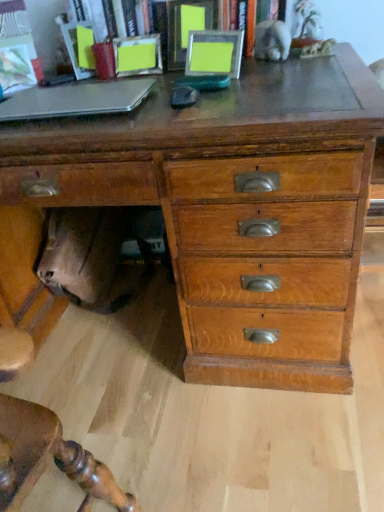
What is the approximate height of metallic silver photo frames at upper center?

metallic silver photo frames at upper center is 9.91 inches tall.

I want to click on wooden chest of drawers at center, so click(236, 208).

From a real-world perspective, is metallic silver photo frames at upper center physically above wooden chest of drawers at center?

Yes, from a real-world perspective, metallic silver photo frames at upper center is on top of wooden chest of drawers at center.

Can you tell me how much metallic silver photo frames at upper center and wooden chest of drawers at center differ in facing direction?

They differ by 0.673 degrees in their facing directions.

From the image's perspective, is metallic silver photo frames at upper center beneath wooden chest of drawers at center?

No.

Does metallic silver photo frames at upper center come behind wooden chest of drawers at center?

Yes, metallic silver photo frames at upper center is behind wooden chest of drawers at center.

From the image's perspective, is silver metallic laptop at left beneath metallic silver photo frames at upper center?

Yes, from the image's perspective, silver metallic laptop at left is beneath metallic silver photo frames at upper center.

Where is `bookcase above the silver metallic laptop at left (from a real-world perspective)`? bookcase above the silver metallic laptop at left (from a real-world perspective) is located at coordinates (186, 26).

Is silver metallic laptop at left oriented away from metallic silver photo frames at upper center?

Yes, silver metallic laptop at left is facing away from metallic silver photo frames at upper center.

Who is shorter, silver metallic laptop at left or metallic silver photo frames at upper center?

With less height is silver metallic laptop at left.

In order to click on the chest of drawers located below the silver metallic laptop at left (from the image's perspective) in this screenshot , I will do `click(236, 208)`.

Based on the photo, does wooden chest of drawers at center turn towards silver metallic laptop at left?

No, wooden chest of drawers at center is not aimed at silver metallic laptop at left.

Which is in front, point (283, 362) or point (92, 82)?

The point (283, 362) is more forward.

Considering the sizes of objects wooden chest of drawers at center and silver metallic laptop at left in the image provided, who is shorter, wooden chest of drawers at center or silver metallic laptop at left?

silver metallic laptop at left.

Could you tell me if wooden chest of drawers at center is turned towards metallic silver photo frames at upper center?

No, wooden chest of drawers at center is not turned towards metallic silver photo frames at upper center.

Is the position of wooden chest of drawers at center more distant than that of metallic silver photo frames at upper center?

No, wooden chest of drawers at center is in front of metallic silver photo frames at upper center.

From the image's perspective, is wooden chest of drawers at center positioned above or below metallic silver photo frames at upper center?

Based on their image positions, wooden chest of drawers at center is located beneath metallic silver photo frames at upper center.

Is silver metallic laptop at left facing away from wooden chest of drawers at center?

No, silver metallic laptop at left is not facing away from wooden chest of drawers at center.

Do you think silver metallic laptop at left is within wooden chest of drawers at center, or outside of it?

silver metallic laptop at left is located beyond the bounds of wooden chest of drawers at center.

Is silver metallic laptop at left taller or shorter than wooden chest of drawers at center?

Clearly, silver metallic laptop at left is shorter compared to wooden chest of drawers at center.

The image size is (384, 512). What are the coordinates of `laptop that appears behind the wooden chest of drawers at center` in the screenshot? It's located at (76, 99).

Does metallic silver photo frames at upper center lie in front of silver metallic laptop at left?

No, metallic silver photo frames at upper center is further to the viewer.

Is metallic silver photo frames at upper center outside of silver metallic laptop at left?

Yes, metallic silver photo frames at upper center is outside of silver metallic laptop at left.

Measure the distance from metallic silver photo frames at upper center to silver metallic laptop at left.

A distance of 16.53 inches exists between metallic silver photo frames at upper center and silver metallic laptop at left.

From a real-world perspective, is metallic silver photo frames at upper center positioned over silver metallic laptop at left based on gravity?

Yes, from a real-world perspective, metallic silver photo frames at upper center is on top of silver metallic laptop at left.

Locate an element on the screen. chest of drawers below the metallic silver photo frames at upper center (from the image's perspective) is located at coordinates (236, 208).

You are a GUI agent. You are given a task and a screenshot of the screen. Output one action in this format:
    pyautogui.click(x=<x>, y=<y>)
    Task: Click on the laptop lying on the left of metallic silver photo frames at upper center
    This screenshot has height=512, width=384.
    Given the screenshot: What is the action you would take?
    pyautogui.click(x=76, y=99)

Looking at the image, which one is located closer to wooden chest of drawers at center, silver metallic laptop at left or metallic silver photo frames at upper center?

silver metallic laptop at left is closer to wooden chest of drawers at center.

Based on their spatial positions, is metallic silver photo frames at upper center or wooden chest of drawers at center further from silver metallic laptop at left?

metallic silver photo frames at upper center lies further to silver metallic laptop at left than the other object.

From the image, which object appears to be farther from silver metallic laptop at left, wooden chest of drawers at center or metallic silver photo frames at upper center?

metallic silver photo frames at upper center is further to silver metallic laptop at left.

Considering their positions, is wooden chest of drawers at center positioned closer to metallic silver photo frames at upper center than silver metallic laptop at left?

The object closer to metallic silver photo frames at upper center is silver metallic laptop at left.

From the image, which object appears to be farther from metallic silver photo frames at upper center, silver metallic laptop at left or wooden chest of drawers at center?

Among the two, wooden chest of drawers at center is located further to metallic silver photo frames at upper center.

Looking at the image, which one is located further to wooden chest of drawers at center, metallic silver photo frames at upper center or silver metallic laptop at left?

metallic silver photo frames at upper center lies further to wooden chest of drawers at center than the other object.

Identify the location of laptop between metallic silver photo frames at upper center and wooden chest of drawers at center in the vertical direction. Image resolution: width=384 pixels, height=512 pixels. (76, 99).